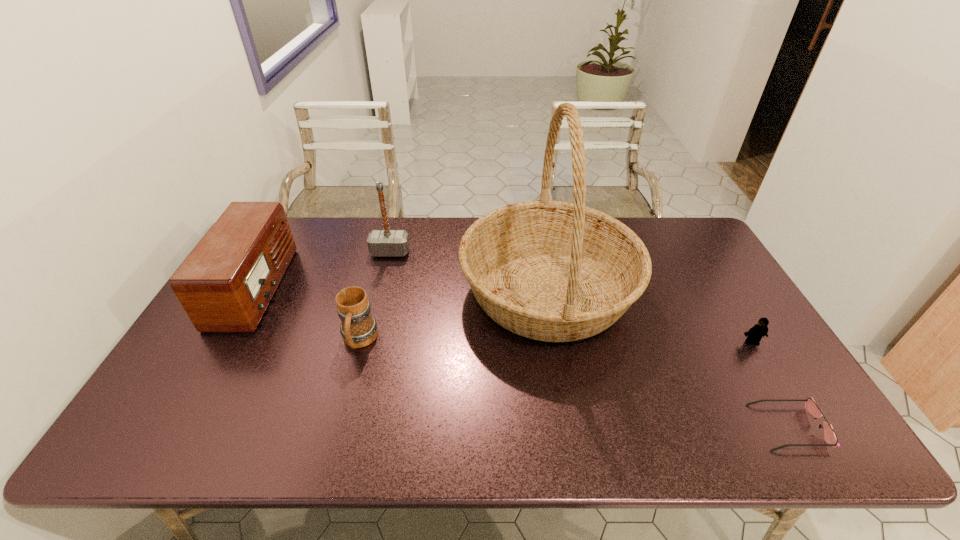
What are the coordinates of `object situated at the near edge` in the screenshot? It's located at (830, 437).

Locate an element on the screen. This screenshot has height=540, width=960. object situated at the left edge is located at coordinates (226, 283).

The height and width of the screenshot is (540, 960). Identify the location of Lego that is positioned at the right edge. (754, 335).

This screenshot has height=540, width=960. Identify the location of sunglasses present at the right edge. (830, 437).

Where is `object positioned at the far left corner`? The image size is (960, 540). object positioned at the far left corner is located at coordinates (226, 283).

Identify the location of object located in the near right corner section of the desktop. This screenshot has width=960, height=540. (830, 437).

This screenshot has width=960, height=540. I want to click on free space at the far edge of the desktop, so click(x=472, y=220).

The height and width of the screenshot is (540, 960). In the image, there is a desktop. Find the location of `vacant space at the near edge`. vacant space at the near edge is located at coordinates (551, 417).

Identify the location of free space at the left edge of the desktop. Image resolution: width=960 pixels, height=540 pixels. (177, 410).

Where is `free location at the right edge of the desktop`? free location at the right edge of the desktop is located at coordinates (719, 287).